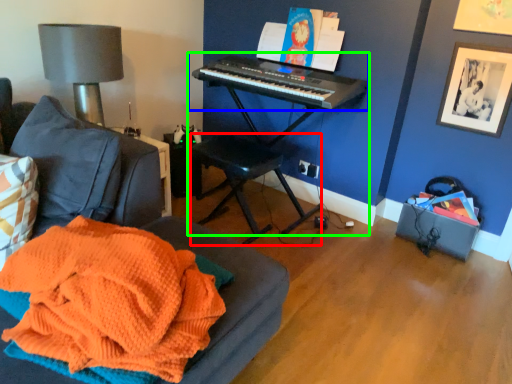
Question: Based on their relative distances, which object is nearer to music stool (highlighted by a red box)? Choose from musical keyboard (highlighted by a blue box) and piano (highlighted by a green box).

Choices:
 (A) musical keyboard
 (B) piano

Answer: (B)